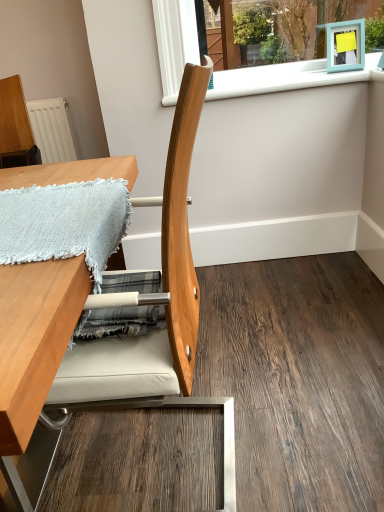
Question: From a real-world perspective, is natural wood chair at center physically located above or below wooden table at left?

Choices:
 (A) below
 (B) above

Answer: (B)

Question: Considering the relative positions of natural wood chair at center and wooden table at left in the image provided, is natural wood chair at center to the left or to the right of wooden table at left?

Choices:
 (A) right
 (B) left

Answer: (A)

Question: Considering the real-world distances, which object is farthest from the white plastic window sill at upper center?

Choices:
 (A) natural wood chair at center
 (B) wooden table at left
 (C) light blue woven blanket at upper left

Answer: (A)

Question: Estimate the real-world distances between objects in this image. Which object is closer to the light blue woven blanket at upper left?

Choices:
 (A) natural wood chair at center
 (B) wooden table at left
 (C) white plastic window sill at upper center

Answer: (B)